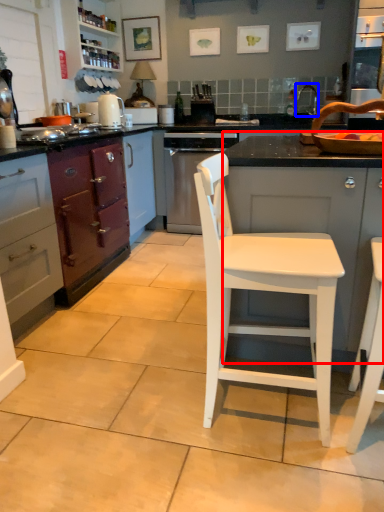
Question: Which point is further to the camera, cabinetry (highlighted by a red box) or faucet (highlighted by a blue box)?

Choices:
 (A) cabinetry
 (B) faucet

Answer: (B)